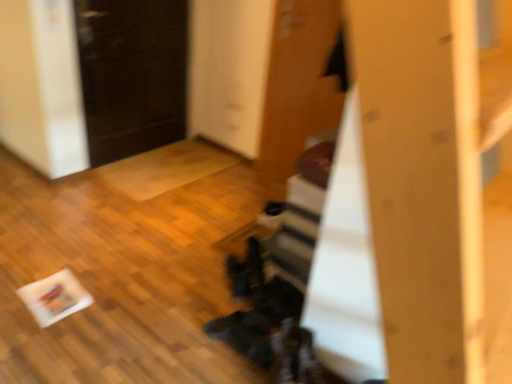
Image resolution: width=512 pixels, height=384 pixels. Identify the location of vacant area located to the right-hand side of black glossy door at upper left, the first door in the left-to-right sequence. (201, 158).